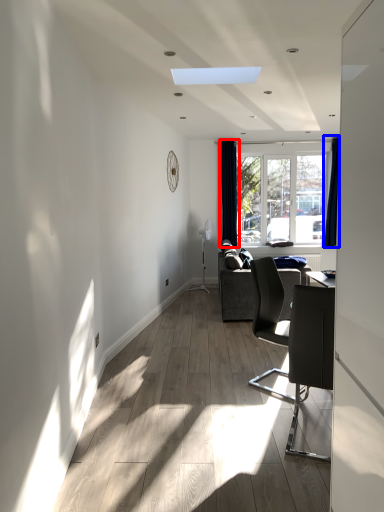
Question: Which of the following is the closest to the observer, curtain (highlighted by a red box) or curtain (highlighted by a blue box)?

Choices:
 (A) curtain
 (B) curtain

Answer: (B)